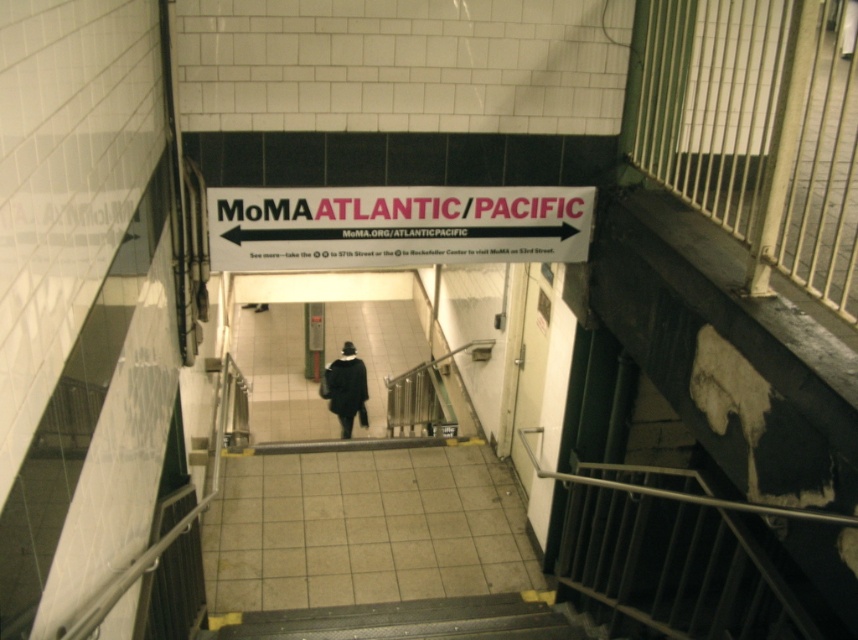
Question: Is white/black plastic sign at upper center below black matte coat at center?

Choices:
 (A) no
 (B) yes

Answer: (A)

Question: Does white/black plastic sign at upper center appear on the right side of black matte coat at center?

Choices:
 (A) yes
 (B) no

Answer: (A)

Question: Is white/black plastic sign at upper center positioned at the back of black matte coat at center?

Choices:
 (A) no
 (B) yes

Answer: (A)